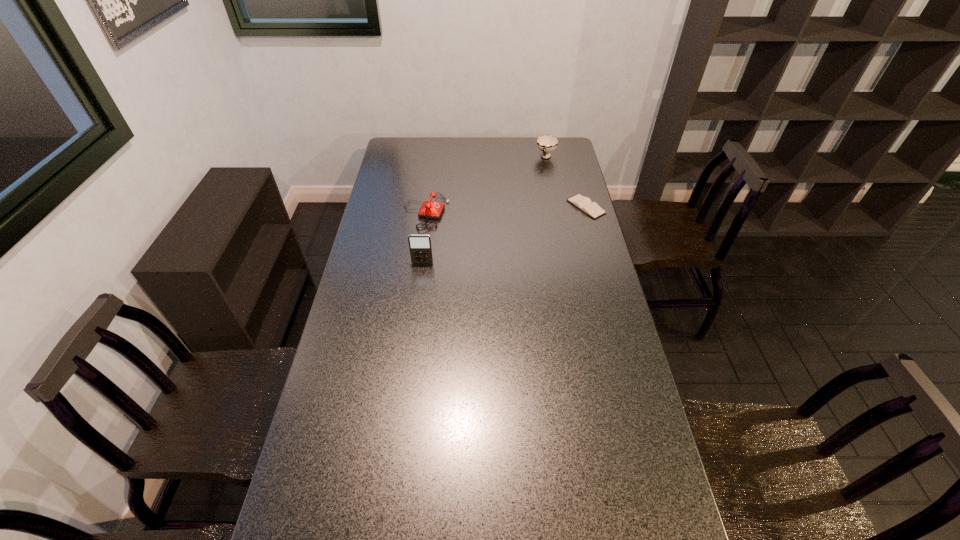
Image resolution: width=960 pixels, height=540 pixels. I want to click on free space at the near edge of the desktop, so click(506, 494).

Find the location of a particular element. The width and height of the screenshot is (960, 540). vacant space at the left edge of the desktop is located at coordinates (368, 235).

Where is `free space at the right edge of the desktop`? free space at the right edge of the desktop is located at coordinates click(x=576, y=183).

This screenshot has height=540, width=960. I want to click on unoccupied area between the third shortest object and the tallest object, so pos(484,210).

Image resolution: width=960 pixels, height=540 pixels. What are the coordinates of `free space between the telephone and the cup` in the screenshot? It's located at (486, 185).

This screenshot has height=540, width=960. I want to click on free space between the second tallest object and the iPod, so click(x=484, y=210).

This screenshot has width=960, height=540. I want to click on free spot between the cup and the shortest object, so click(566, 182).

Where is `empty location between the iPod and the third shortest object`? The height and width of the screenshot is (540, 960). empty location between the iPod and the third shortest object is located at coordinates (484, 210).

This screenshot has width=960, height=540. In order to click on free area in between the third shortest object and the shortest object in this screenshot , I will do `click(566, 182)`.

This screenshot has height=540, width=960. I want to click on empty space between the telephone and the cup, so click(486, 185).